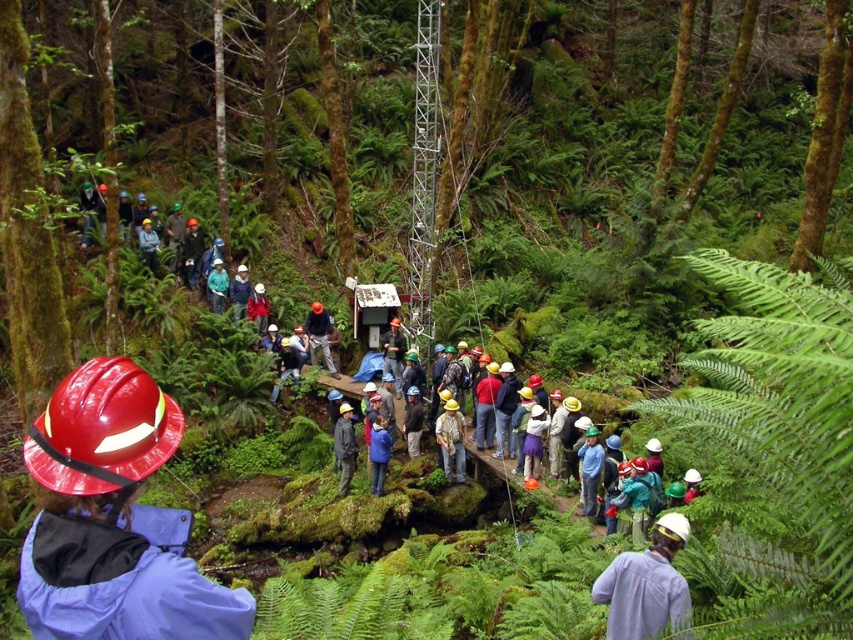
Question: Does white matte helmet at center have a smaller size compared to blue fabric jacket at center?

Choices:
 (A) no
 (B) yes

Answer: (A)

Question: Does shiny red hard hat at center have a greater width compared to dark gray jacket at center?

Choices:
 (A) no
 (B) yes

Answer: (B)

Question: Estimate the real-world distances between objects in this image. Which object is closer to the green matte jacket at center?

Choices:
 (A) matte red jacket at center
 (B) dark gray fabric jacket at center
 (C) camouflage fabric shirt at center

Answer: (A)

Question: Which point is farther from the camera taking this photo?

Choices:
 (A) [x=262, y=296]
 (B) [x=379, y=435]

Answer: (A)

Question: Is green leafy fern at lower right in front of green matte jacket at center?

Choices:
 (A) no
 (B) yes

Answer: (B)

Question: Considering the real-world distances, which object is farthest from the camouflage fabric shirt at center?

Choices:
 (A) dark gray jacket at center
 (B) shiny red hard hat at center
 (C) green matte jacket at center

Answer: (B)